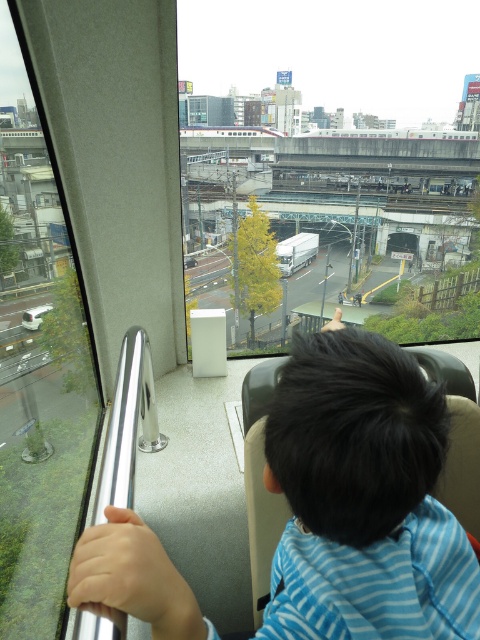
You are a passenger on the train and you want to check the weather outside. You notice the blue striped shirt at center and the transparent glass train window at left. Which object would you look through to see the weather conditions outside?

You should look through the transparent glass train window at left because the blue striped shirt at center is smaller and likely blocking the view.